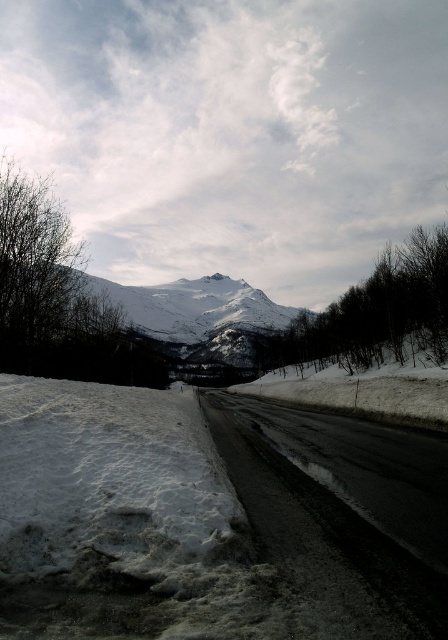
Question: Is white fluffy snow at lower left thinner than snowy rocky mountain at center?

Choices:
 (A) no
 (B) yes

Answer: (B)

Question: Among these points, which one is farthest from the camera?

Choices:
 (A) (1, 566)
 (B) (197, 282)

Answer: (B)

Question: Is white fluffy snow at lower left further to camera compared to snowy rocky mountain at center?

Choices:
 (A) no
 (B) yes

Answer: (A)

Question: Which point is farther to the camera?

Choices:
 (A) click(x=137, y=474)
 (B) click(x=202, y=314)

Answer: (B)

Question: Which point is farther to the camera?

Choices:
 (A) white fluffy snow at lower left
 (B) snowy rocky mountain at center

Answer: (B)

Question: Does white fluffy snow at lower left appear on the right side of snowy rocky mountain at center?

Choices:
 (A) no
 (B) yes

Answer: (B)